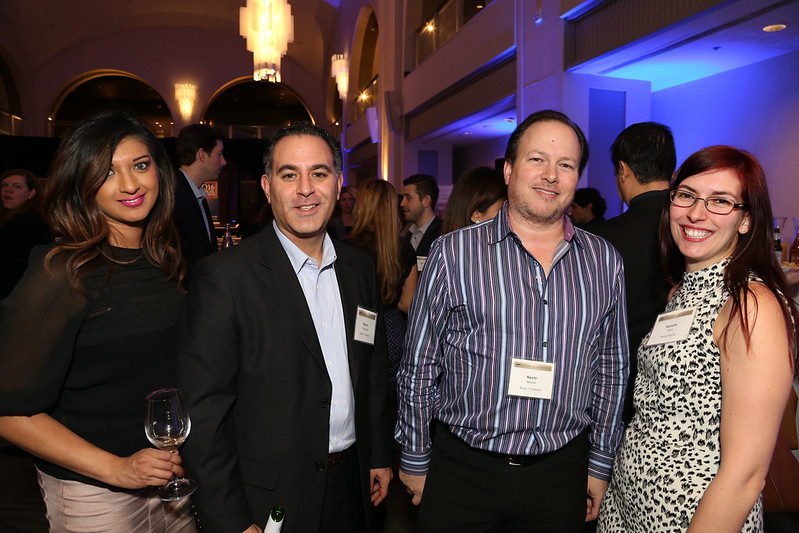
This screenshot has width=799, height=533. I want to click on bottle, so click(275, 515).